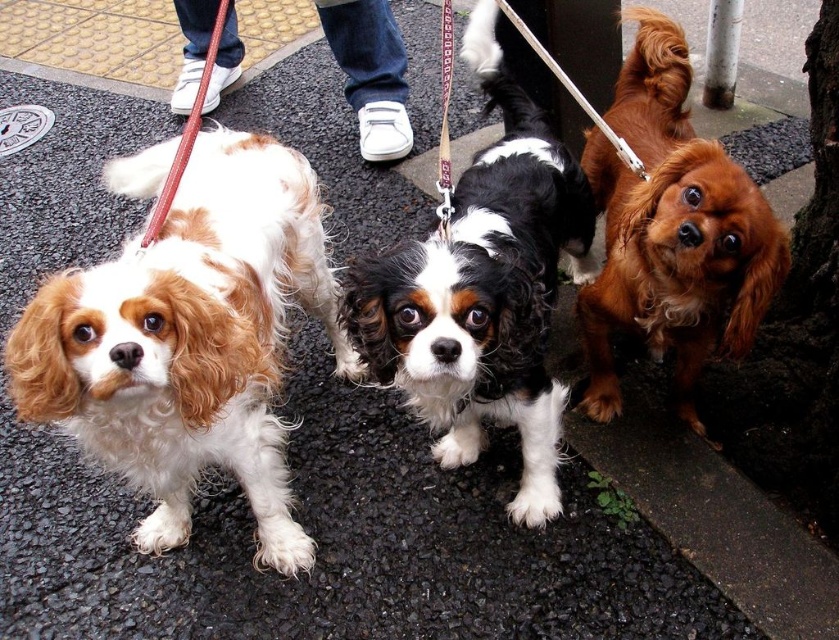
You are a dog owner who wants to choose a leash that is taller between the red leather leash at left and the brown leather leash at center. Which leash should you choose?

The brown leather leash at center is taller than the red leather leash at left, so you should choose the brown leather leash at center.

You are a photographer trying to capture a clear shot of both the white and brown fur at left and the shiny brown fur at center. Since the dogs are on a leash and might not move much, you want to adjust your camera angle to ensure both are visible. Based on their positions, which dog should you focus on first to ensure both are in frame?

The white and brown fur at left is below the shiny brown fur at center, so you should focus on the shiny brown fur at center first to ensure the white and brown fur at left, which is lower, is still in the frame.

You are a photographer standing in front of the three Cavalier King Charles Spaniels on the wet pavement. You want to take a photo that includes both the point at coordinates point (185, 124) and point (447, 92). Which point should you focus on first to ensure both are in sharp focus?

You should focus on point (185, 124) first because it is closer to you than point (447, 92). Since it is closer, focusing on it will help ensure both points are within the depth of field required for sharpness.